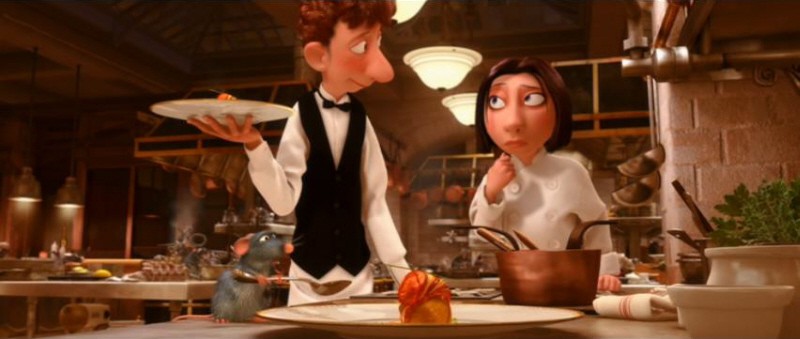
You are a GUI agent. You are given a task and a screenshot of the screen. Output one action in this format:
    pyautogui.click(x=<x>, y=<y>)
    Task: Click on the plate
    
    Given the screenshot: What is the action you would take?
    pyautogui.click(x=526, y=310)